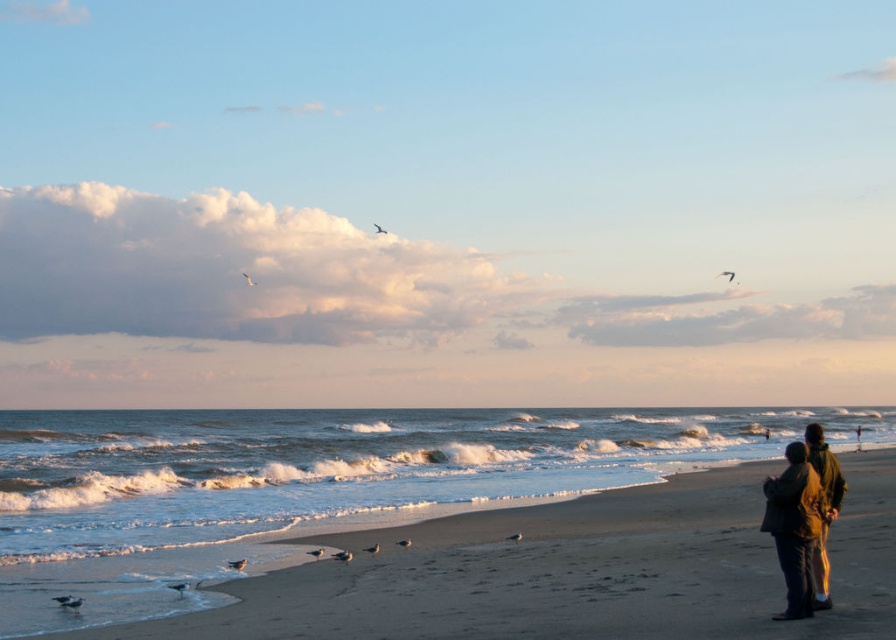
Question: Can you confirm if sandy beach at lower right is positioned above green fabric jacket at lower right?

Choices:
 (A) yes
 (B) no

Answer: (B)

Question: Which object is positioned farthest from the green woolen jacket at lower right?

Choices:
 (A) sandy beach at lower right
 (B) green fabric jacket at lower right

Answer: (A)

Question: In this image, where is green fabric jacket at lower right located relative to green woolen jacket at lower right?

Choices:
 (A) left
 (B) right

Answer: (A)

Question: Which object is closer to the camera taking this photo?

Choices:
 (A) sandy beach at lower right
 (B) green fabric jacket at lower right

Answer: (A)

Question: Which object is the closest to the green fabric jacket at lower right?

Choices:
 (A) sandy beach at lower right
 (B) green woolen jacket at lower right

Answer: (B)

Question: Is green fabric jacket at lower right bigger than green woolen jacket at lower right?

Choices:
 (A) no
 (B) yes

Answer: (B)